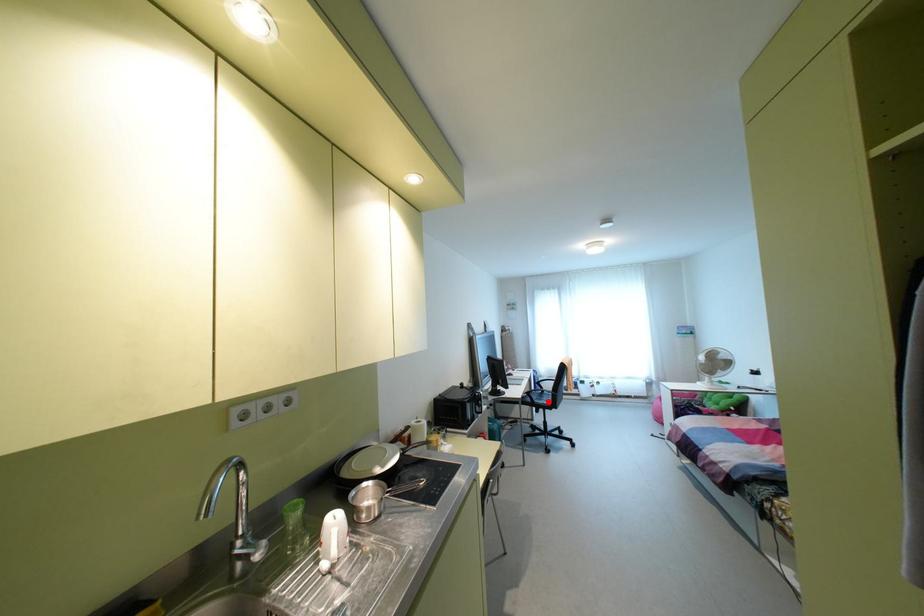
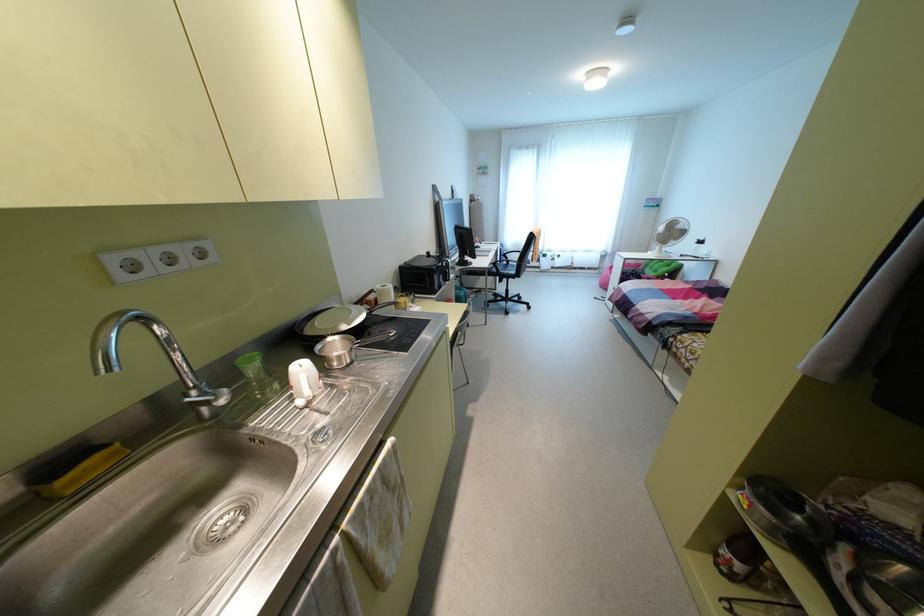
Where in the second image is the point corresponding to the highlighted location from the first image?

(513, 272)